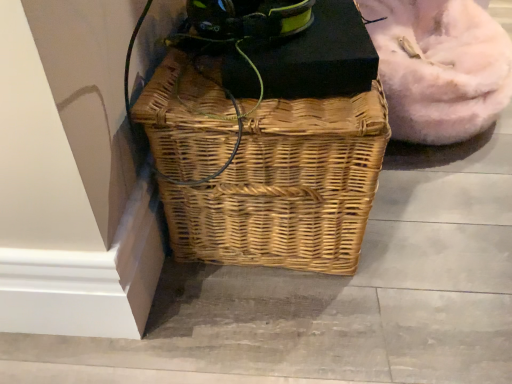
The height and width of the screenshot is (384, 512). I want to click on natural wicker picnic basket at center, so [x=262, y=170].

What is the approximate width of natural wicker picnic basket at center?

natural wicker picnic basket at center is 43.44 centimeters wide.

The height and width of the screenshot is (384, 512). What do you see at coordinates (262, 170) in the screenshot?
I see `natural wicker picnic basket at center` at bounding box center [262, 170].

What is the approximate height of natural wicker picnic basket at center?

The height of natural wicker picnic basket at center is 16.09 inches.

This screenshot has height=384, width=512. I want to click on natural wicker picnic basket at center, so click(x=262, y=170).